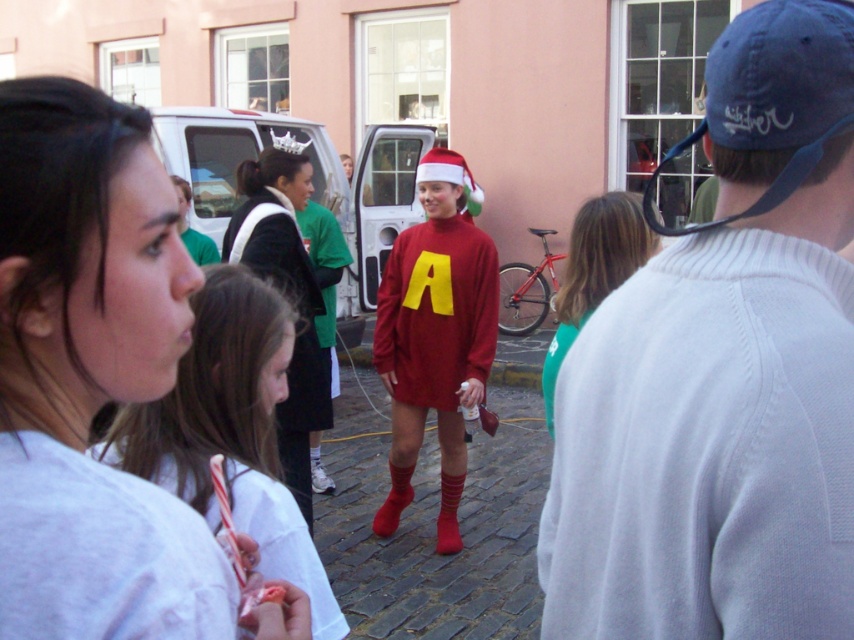
Question: Which object is positioned farthest from the white knit sweater at center?

Choices:
 (A) white matte shirt at lower left
 (B) velvet black dress at center
 (C) white matte shirt at center

Answer: (B)

Question: Which is nearer to the white matte shirt at lower left?

Choices:
 (A) green matte shirt at center
 (B) white knit sweater at center

Answer: (B)

Question: Which of the following is the closest to the observer?

Choices:
 (A) (145, 477)
 (B) (461, 419)
 (C) (566, 492)
 (D) (309, 417)

Answer: (C)

Question: Can you confirm if white matte shirt at lower left is positioned to the right of matte red sweater at center?

Choices:
 (A) no
 (B) yes

Answer: (A)

Question: Is white knit sweater at center to the right of green matte shirt at center from the viewer's perspective?

Choices:
 (A) no
 (B) yes

Answer: (A)

Question: Does white matte shirt at center have a lesser width compared to matte red sweater at center?

Choices:
 (A) yes
 (B) no

Answer: (A)